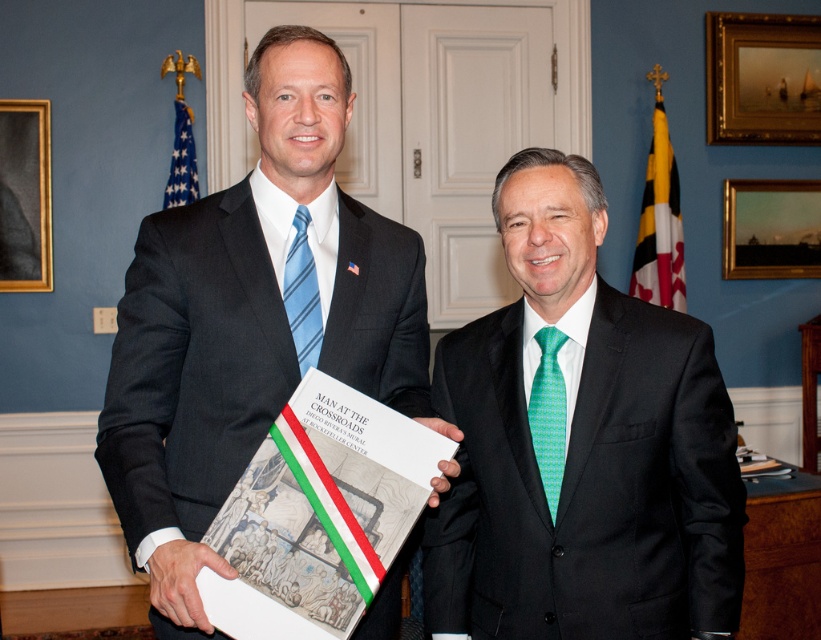
Does point (817, 198) come closer to viewer compared to point (301, 372)?

That is False.

Can you confirm if gold wooden picture frame at upper right is positioned to the right of blue striped tie at left?

Correct, you'll find gold wooden picture frame at upper right to the right of blue striped tie at left.

Between point (746, 243) and point (292, 246), which one is positioned behind?

The point (746, 243) is behind.

Identify the location of gold wooden picture frame at upper right. (771, 228).

Can you confirm if gold-framed painting at upper right is taller than gold wooden picture frame at upper left?

No, gold-framed painting at upper right is not taller than gold wooden picture frame at upper left.

Who is shorter, gold-framed painting at upper right or gold wooden picture frame at upper left?

gold-framed painting at upper right

Between point (723, 52) and point (28, 100), which one is positioned behind?

Point (723, 52)

Locate an element on the screen. gold-framed painting at upper right is located at coordinates (762, 77).

The image size is (821, 640). Identify the location of gold-framed painting at upper right. (762, 77).

Who is more forward, (709, 68) or (544, 436)?

Positioned in front is point (544, 436).

I want to click on gold-framed painting at upper right, so click(762, 77).